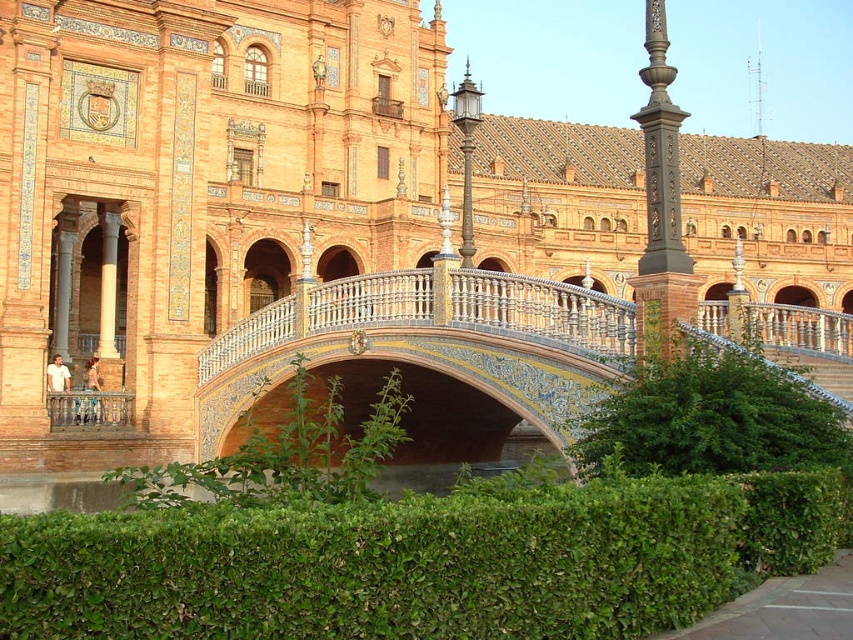
You are standing at point (432, 340) in the image. What object are you directly facing?

You are directly facing the decorative ceramic bridge at center located at point (432, 340).

You are standing at the entrance of the traditional Spanish architectural building in the image. You want to cross to the other side of the water feature. Where is the decorative ceramic bridge at center located relative to your current position?

The decorative ceramic bridge at center is located at point 0.534 on the x axis and 0.508 on the y axis relative to your current position at the entrance.

You are a gardener planning to trim the green leafy hedge at center and the dark brown ornate post at center. Which object requires more horizontal space to maintain its current appearance?

The dark brown ornate post at center requires more horizontal space because the green leafy hedge at center has a lesser width compared to it.